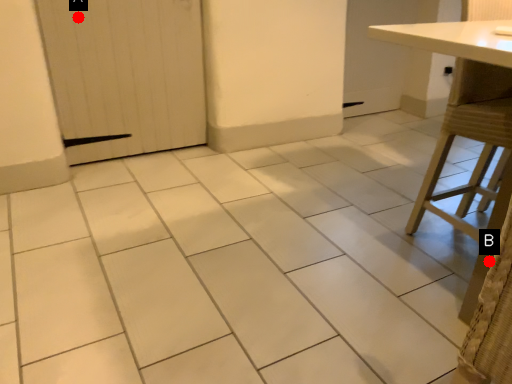
Question: Two points are circled on the image, labeled by A and B beside each circle. Which of the following is the closest to the observer?

Choices:
 (A) A is closer
 (B) B is closer

Answer: (B)